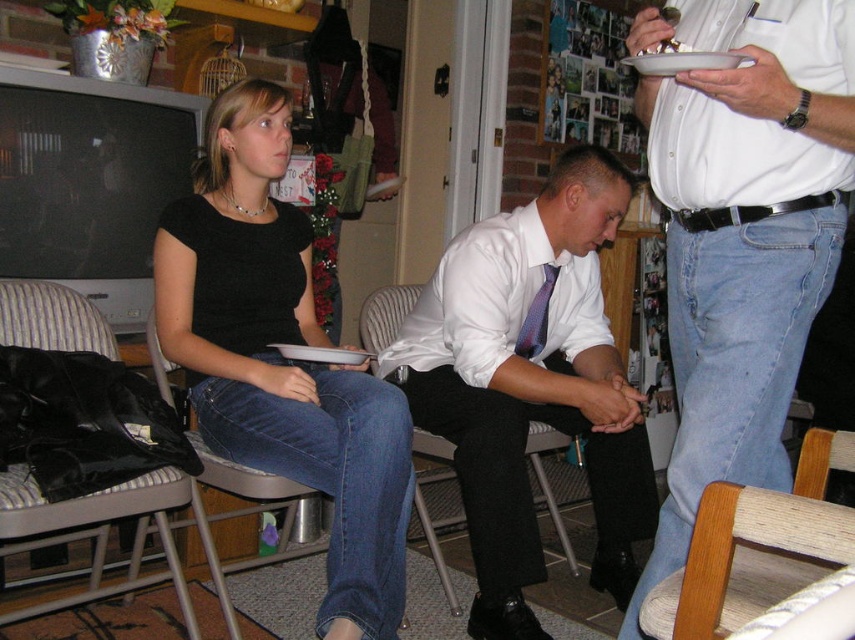
Who is higher up, white shirt at upper right or wooden chair at lower right?

white shirt at upper right

Is point (806, 93) positioned after point (773, 545)?

Yes, point (806, 93) is farther from viewer.

Image resolution: width=855 pixels, height=640 pixels. I want to click on white shirt at upper right, so click(x=741, y=234).

From the picture: Who is positioned more to the right, white satin shirt at center or matte black shirt at center?

white satin shirt at center

Does white satin shirt at center have a lesser height compared to matte black shirt at center?

In fact, white satin shirt at center may be taller than matte black shirt at center.

The width and height of the screenshot is (855, 640). What do you see at coordinates (531, 384) in the screenshot? I see `white satin shirt at center` at bounding box center [531, 384].

Find the location of a particular element. The height and width of the screenshot is (640, 855). white satin shirt at center is located at coordinates (531, 384).

Between point (687, 637) and point (217, 572), which one is positioned in front?

Point (687, 637) is more forward.

Who is lower down, wooden chair at lower right or velvet black armchair at left?

Positioned lower is velvet black armchair at left.

Is point (705, 618) positioned behind point (12, 468)?

No, (705, 618) is in front of (12, 468).

Where is `wooden chair at lower right`? Image resolution: width=855 pixels, height=640 pixels. wooden chair at lower right is located at coordinates (756, 547).